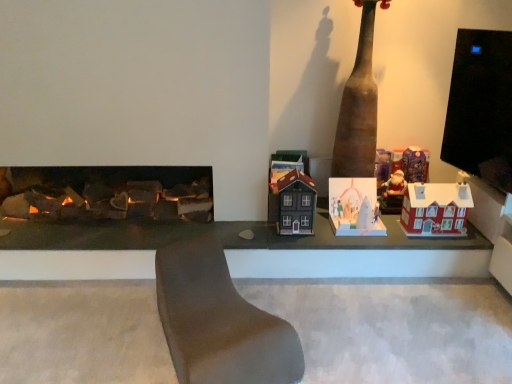
Question: Considering the relative positions of shiny purple wrapping paper at upper right, the third toy when ordered from left to right, and matte brown house at center, the 1th toy from the left, in the image provided, is shiny purple wrapping paper at upper right, the third toy when ordered from left to right, to the right of matte brown house at center, the 1th toy from the left, from the viewer's perspective?

Choices:
 (A) yes
 (B) no

Answer: (A)

Question: Is shiny purple wrapping paper at upper right, positioned as the 2th toy in right-to-left order, behind matte brown house at center, acting as the 4th toy starting from the right?

Choices:
 (A) no
 (B) yes

Answer: (B)

Question: Is matte brown house at center, acting as the 4th toy starting from the right, located within shiny purple wrapping paper at upper right, positioned as the 2th toy in right-to-left order?

Choices:
 (A) no
 (B) yes

Answer: (A)

Question: Is shiny purple wrapping paper at upper right, the third toy when ordered from left to right, taller than matte brown house at center, the 1th toy from the left?

Choices:
 (A) yes
 (B) no

Answer: (B)

Question: Is shiny purple wrapping paper at upper right, positioned as the 2th toy in right-to-left order, wider than matte brown house at center, acting as the 4th toy starting from the right?

Choices:
 (A) no
 (B) yes

Answer: (A)

Question: From the image's perspective, is shiny purple wrapping paper at upper right, the third toy when ordered from left to right, on top of matte brown house at center, the 1th toy from the left?

Choices:
 (A) no
 (B) yes

Answer: (B)

Question: Considering the relative positions of brown leather couch at center and brown matte totem pole at center in the image provided, is brown leather couch at center behind brown matte totem pole at center?

Choices:
 (A) yes
 (B) no

Answer: (B)

Question: Can you confirm if brown leather couch at center is bigger than brown matte totem pole at center?

Choices:
 (A) no
 (B) yes

Answer: (B)

Question: Can you confirm if brown leather couch at center is taller than brown matte totem pole at center?

Choices:
 (A) no
 (B) yes

Answer: (A)

Question: Is brown leather couch at center aimed at brown matte totem pole at center?

Choices:
 (A) no
 (B) yes

Answer: (A)

Question: Considering the relative sizes of brown leather couch at center and brown matte totem pole at center in the image provided, is brown leather couch at center wider than brown matte totem pole at center?

Choices:
 (A) yes
 (B) no

Answer: (A)

Question: Does brown leather couch at center appear on the left side of brown matte totem pole at center?

Choices:
 (A) no
 (B) yes

Answer: (B)

Question: Can you confirm if matte brown house at center, acting as the 4th toy starting from the right, is bigger than brown leather couch at center?

Choices:
 (A) yes
 (B) no

Answer: (B)